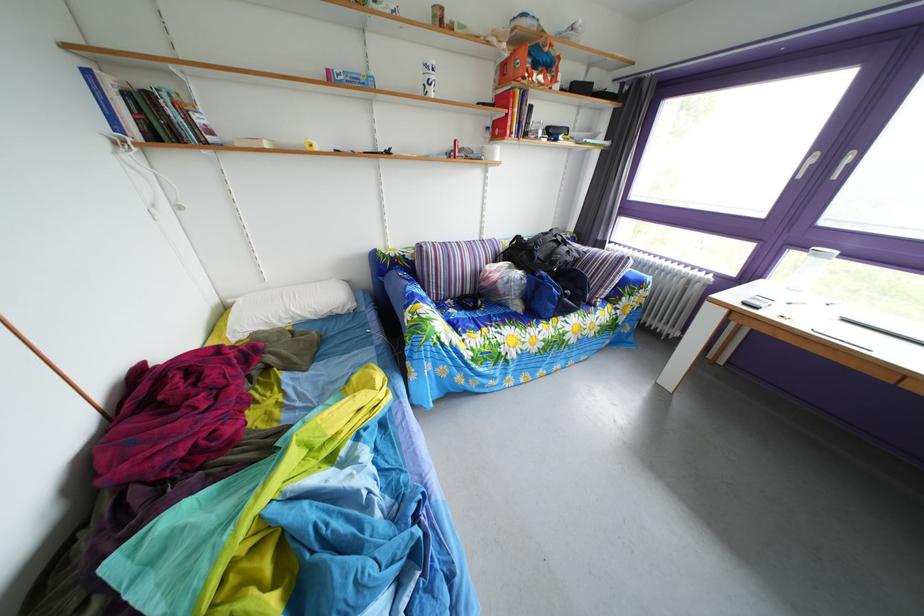
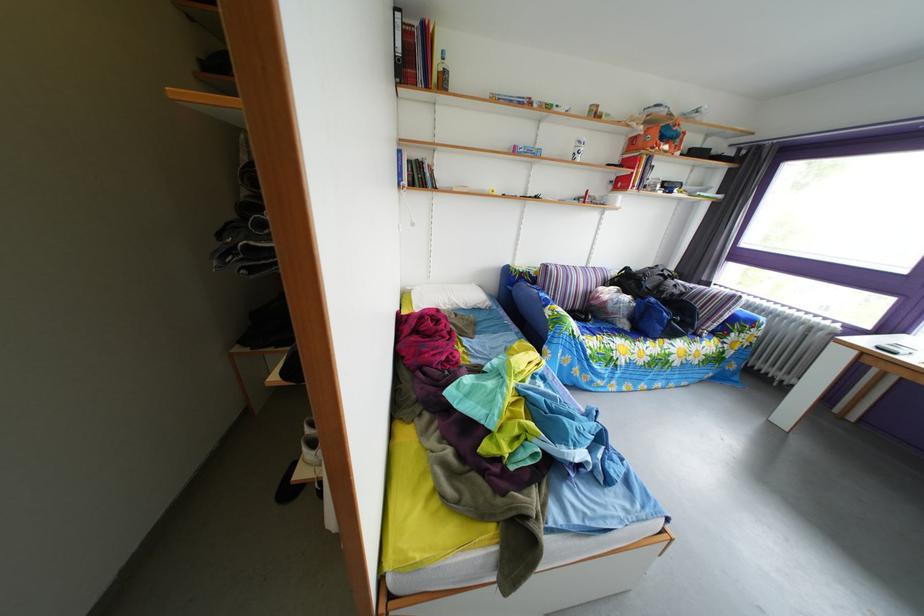
Where in the second image is the point corresponding to [553,282] from the first image?

(663, 307)